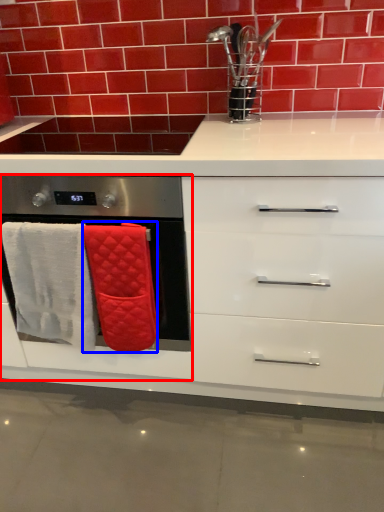
Question: Which of the following is the farthest to the observer, oven (highlighted by a red box) or bath towel (highlighted by a blue box)?

Choices:
 (A) oven
 (B) bath towel

Answer: (B)